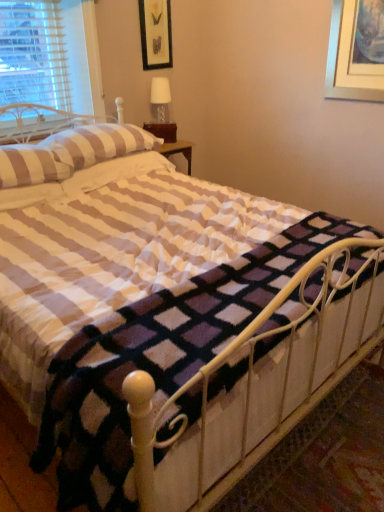
Describe the element at coordinates (114, 170) in the screenshot. I see `striped fabric pillow at upper left, the 3th pillow when ordered from front to back` at that location.

In order to face striped fabric pillow at upper left, marked as the 2th pillow in a front-to-back arrangement, should I rotate leftwards or rightwards?

To align with it, rotate left about 12.255°.

Image resolution: width=384 pixels, height=512 pixels. Describe the element at coordinates (251, 376) in the screenshot. I see `white metal bed frame at center` at that location.

Where is `striped fabric pillow at upper left, which appears as the first pillow when viewed from the back`? This screenshot has height=512, width=384. striped fabric pillow at upper left, which appears as the first pillow when viewed from the back is located at coordinates (114, 170).

Consider the image. Does black matte picture frame at upper center touch striped fabric pillow at upper left, the 3th pillow when ordered from front to back?

No, black matte picture frame at upper center is not in contact with striped fabric pillow at upper left, the 3th pillow when ordered from front to back.

From the image's perspective, is black matte picture frame at upper center located above striped fabric pillow at upper left, the 3th pillow when ordered from front to back?

Yes.

Consider the image. Can you confirm if black matte picture frame at upper center is shorter than striped fabric pillow at upper left, which appears as the first pillow when viewed from the back?

Incorrect, the height of black matte picture frame at upper center does not fall short of that of striped fabric pillow at upper left, which appears as the first pillow when viewed from the back.

What's the angular difference between black matte picture frame at upper center and striped fabric pillow at upper left, which appears as the first pillow when viewed from the back,'s facing directions?

They differ by 1.59 degrees in their facing directions.

Based on their positions, is striped fabric pillow at upper left, marked as the 2th pillow in a front-to-back arrangement, located to the left or right of striped fabric pillow at upper left, which is the 1th pillow in front-to-back order?

striped fabric pillow at upper left, marked as the 2th pillow in a front-to-back arrangement, is positioned on striped fabric pillow at upper left, which is the 1th pillow in front-to-back order,'s right side.

Is striped fabric pillow at upper left, marked as the 2th pillow in a front-to-back arrangement, outside of striped fabric pillow at upper left, the 3th pillow in the back-to-front sequence?

Yes, striped fabric pillow at upper left, marked as the 2th pillow in a front-to-back arrangement, is not within striped fabric pillow at upper left, the 3th pillow in the back-to-front sequence.

Is striped fabric pillow at upper left, the 2th pillow viewed from the back, thinner than striped fabric pillow at upper left, which is the 1th pillow in front-to-back order?

Indeed, striped fabric pillow at upper left, the 2th pillow viewed from the back, has a lesser width compared to striped fabric pillow at upper left, which is the 1th pillow in front-to-back order.

Could you tell me if striped fabric pillow at upper left, marked as the 2th pillow in a front-to-back arrangement, is turned towards striped fabric pillow at upper left, which is the 1th pillow in front-to-back order?

No, striped fabric pillow at upper left, marked as the 2th pillow in a front-to-back arrangement, is not aimed at striped fabric pillow at upper left, which is the 1th pillow in front-to-back order.

Is striped fabric pillow at upper left, which appears as the first pillow when viewed from the back, bigger than black matte picture frame at upper center?

Correct, striped fabric pillow at upper left, which appears as the first pillow when viewed from the back, is larger in size than black matte picture frame at upper center.

Could you measure the distance between striped fabric pillow at upper left, the 3th pillow when ordered from front to back, and black matte picture frame at upper center?

A distance of 1.01 meters exists between striped fabric pillow at upper left, the 3th pillow when ordered from front to back, and black matte picture frame at upper center.

Is striped fabric pillow at upper left, the 3th pillow when ordered from front to back, at the left side of black matte picture frame at upper center?

Yes.

Looking at their sizes, would you say striped fabric pillow at upper left, the 3th pillow when ordered from front to back, is wider or thinner than black matte picture frame at upper center?

In the image, striped fabric pillow at upper left, the 3th pillow when ordered from front to back, appears to be wider than black matte picture frame at upper center.

Is striped fabric pillow at upper left, which appears as the first pillow when viewed from the back, shorter than striped fabric pillow at upper left, the 2th pillow viewed from the back?

Yes.

Where is `pillow that is the 1st object located in front of the striped fabric pillow at upper left, which appears as the first pillow when viewed from the back`? The height and width of the screenshot is (512, 384). pillow that is the 1st object located in front of the striped fabric pillow at upper left, which appears as the first pillow when viewed from the back is located at coordinates (98, 143).

From the image's perspective, which object appears higher, striped fabric pillow at upper left, the 3th pillow when ordered from front to back, or striped fabric pillow at upper left, marked as the 2th pillow in a front-to-back arrangement?

striped fabric pillow at upper left, marked as the 2th pillow in a front-to-back arrangement.

Between striped fabric pillow at upper left, which appears as the first pillow when viewed from the back, and striped fabric pillow at upper left, marked as the 2th pillow in a front-to-back arrangement, which one has smaller width?

striped fabric pillow at upper left, marked as the 2th pillow in a front-to-back arrangement.

Is black matte picture frame at upper center to the left or to the right of white matte table lamp at upper center in the image?

black matte picture frame at upper center is positioned on white matte table lamp at upper center's left side.

Does black matte picture frame at upper center contain white matte table lamp at upper center?

No, white matte table lamp at upper center is not a part of black matte picture frame at upper center.

Which point is more forward, (167, 32) or (156, 100)?

Point (167, 32)

Which object is closer to the camera, black matte picture frame at upper center or white matte table lamp at upper center?

Positioned in front is black matte picture frame at upper center.

Considering the sizes of objects white matte table lamp at upper center and black matte picture frame at upper center in the image provided, who is wider, white matte table lamp at upper center or black matte picture frame at upper center?

With larger width is white matte table lamp at upper center.

In the scene shown: Is white matte table lamp at upper center at the left side of black matte picture frame at upper center?

No.

Which is in front, white matte table lamp at upper center or black matte picture frame at upper center?

black matte picture frame at upper center.

Which point is more distant from viewer, (51, 157) or (85, 186)?

The point (85, 186) is behind.

Considering the sizes of objects striped fabric pillow at upper left, which is the 1th pillow in front-to-back order, and striped fabric pillow at upper left, which appears as the first pillow when viewed from the back, in the image provided, who is taller, striped fabric pillow at upper left, which is the 1th pillow in front-to-back order, or striped fabric pillow at upper left, which appears as the first pillow when viewed from the back,?

striped fabric pillow at upper left, which is the 1th pillow in front-to-back order, is taller.

Is the surface of striped fabric pillow at upper left, which is the 1th pillow in front-to-back order, in direct contact with striped fabric pillow at upper left, the 3th pillow when ordered from front to back?

No, striped fabric pillow at upper left, which is the 1th pillow in front-to-back order, is not making contact with striped fabric pillow at upper left, the 3th pillow when ordered from front to back.

Which is more to the right, striped fabric pillow at upper left, which is the 1th pillow in front-to-back order, or striped fabric pillow at upper left, the 3th pillow when ordered from front to back?

Positioned to the right is striped fabric pillow at upper left, the 3th pillow when ordered from front to back.

Image resolution: width=384 pixels, height=512 pixels. What are the coordinates of `picture frame lying on the right of striped fabric pillow at upper left, which appears as the first pillow when viewed from the back` in the screenshot? It's located at (156, 34).

What are the coordinates of `the 1st pillow behind the striped fabric pillow at upper left, which is the 1th pillow in front-to-back order` in the screenshot? It's located at pyautogui.click(x=98, y=143).

Estimate the real-world distances between objects in this image. Which object is closer to white metal bed frame at center, striped fabric pillow at upper left, the 2th pillow viewed from the back, or striped fabric pillow at upper left, which appears as the first pillow when viewed from the back?

striped fabric pillow at upper left, which appears as the first pillow when viewed from the back, is positioned closer to the anchor white metal bed frame at center.

Looking at the image, which one is located further to striped fabric pillow at upper left, the 2th pillow viewed from the back, striped fabric pillow at upper left, which is the 1th pillow in front-to-back order, or white matte table lamp at upper center?

Based on the image, white matte table lamp at upper center appears to be further to striped fabric pillow at upper left, the 2th pillow viewed from the back.

Based on their spatial positions, is striped fabric pillow at upper left, which appears as the first pillow when viewed from the back, or white metal bed frame at center further from striped fabric pillow at upper left, marked as the 2th pillow in a front-to-back arrangement?

white metal bed frame at center lies further to striped fabric pillow at upper left, marked as the 2th pillow in a front-to-back arrangement, than the other object.

Which object lies nearer to the anchor point striped fabric pillow at upper left, marked as the 2th pillow in a front-to-back arrangement, black matte picture frame at upper center or white matte table lamp at upper center?

Based on the image, white matte table lamp at upper center appears to be nearer to striped fabric pillow at upper left, marked as the 2th pillow in a front-to-back arrangement.

Based on their spatial positions, is white metal bed frame at center or striped fabric pillow at upper left, the 2th pillow viewed from the back, further from striped fabric pillow at upper left, which appears as the first pillow when viewed from the back?

Based on the image, white metal bed frame at center appears to be further to striped fabric pillow at upper left, which appears as the first pillow when viewed from the back.

Looking at this image, based on their spatial positions, is striped fabric pillow at upper left, marked as the 2th pillow in a front-to-back arrangement, or white metal bed frame at center closer to striped fabric pillow at upper left, the 3th pillow when ordered from front to back?

The object closer to striped fabric pillow at upper left, the 3th pillow when ordered from front to back, is striped fabric pillow at upper left, marked as the 2th pillow in a front-to-back arrangement.

Which object lies further to the anchor point white matte table lamp at upper center, striped fabric pillow at upper left, marked as the 2th pillow in a front-to-back arrangement, or white metal bed frame at center?

Among the two, white metal bed frame at center is located further to white matte table lamp at upper center.

Estimate the real-world distances between objects in this image. Which object is further from black matte picture frame at upper center, white metal bed frame at center or white matte table lamp at upper center?

The object further to black matte picture frame at upper center is white metal bed frame at center.

This screenshot has width=384, height=512. In order to click on pillow located between white metal bed frame at center and striped fabric pillow at upper left, the 2th pillow viewed from the back, in the depth direction in this screenshot , I will do `click(29, 166)`.

Find the location of a particular element. The height and width of the screenshot is (512, 384). pillow between black matte picture frame at upper center and striped fabric pillow at upper left, which appears as the first pillow when viewed from the back, in the vertical direction is located at coordinates (98, 143).

Identify the location of table lamp between black matte picture frame at upper center and striped fabric pillow at upper left, the 3th pillow when ordered from front to back, from top to bottom. The width and height of the screenshot is (384, 512). (160, 99).

Identify the location of pillow located between striped fabric pillow at upper left, the 2th pillow viewed from the back, and white matte table lamp at upper center in the depth direction. The width and height of the screenshot is (384, 512). (114, 170).